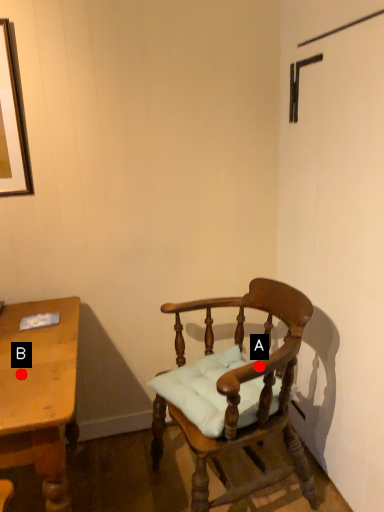
Question: Two points are circled on the image, labeled by A and B beside each circle. Which point is farther to the camera?

Choices:
 (A) A is further
 (B) B is further

Answer: (A)